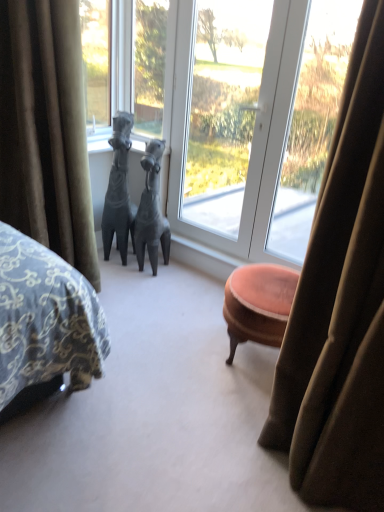
Where is `free space in front of matte gray horse at center, the 2th animal in the right-to-left sequence`? free space in front of matte gray horse at center, the 2th animal in the right-to-left sequence is located at coordinates (119, 273).